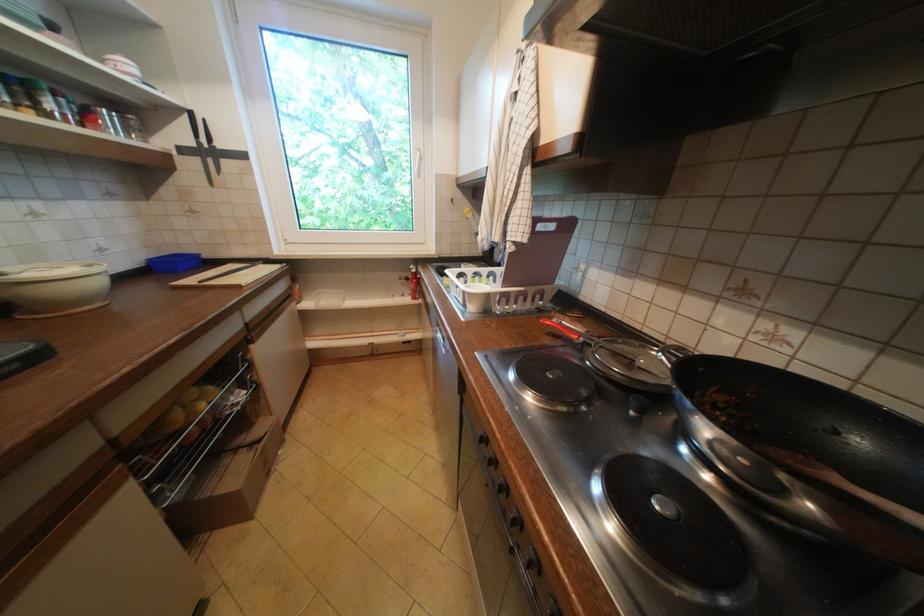
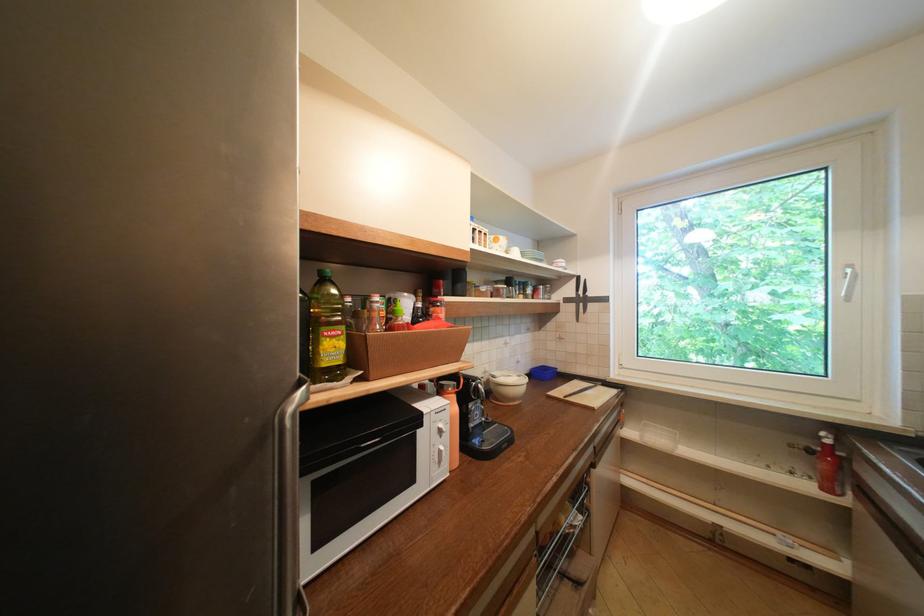
Find the pixel in the second image that matches (x=419, y=270) in the first image.

(829, 439)